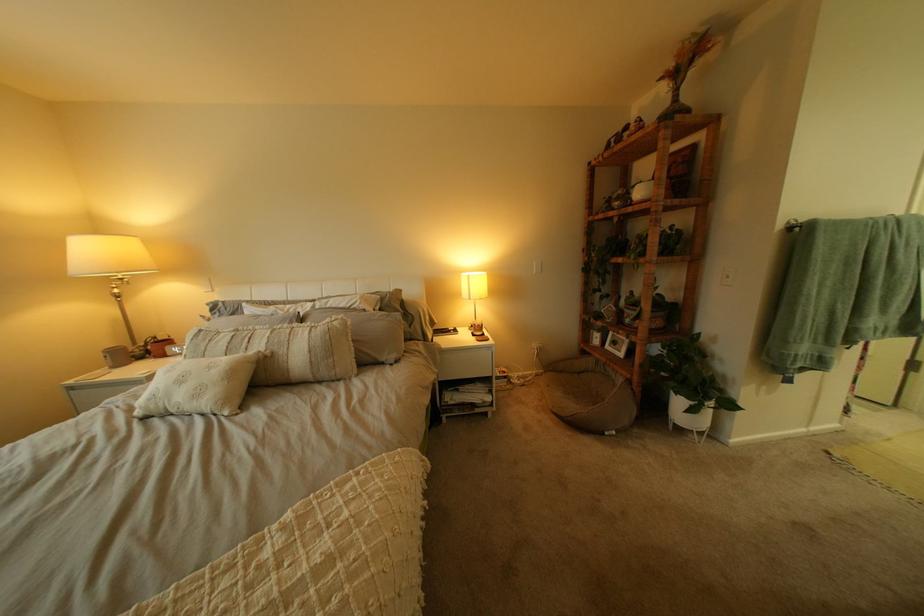
Identify the location of red digital clock. tap(175, 349).